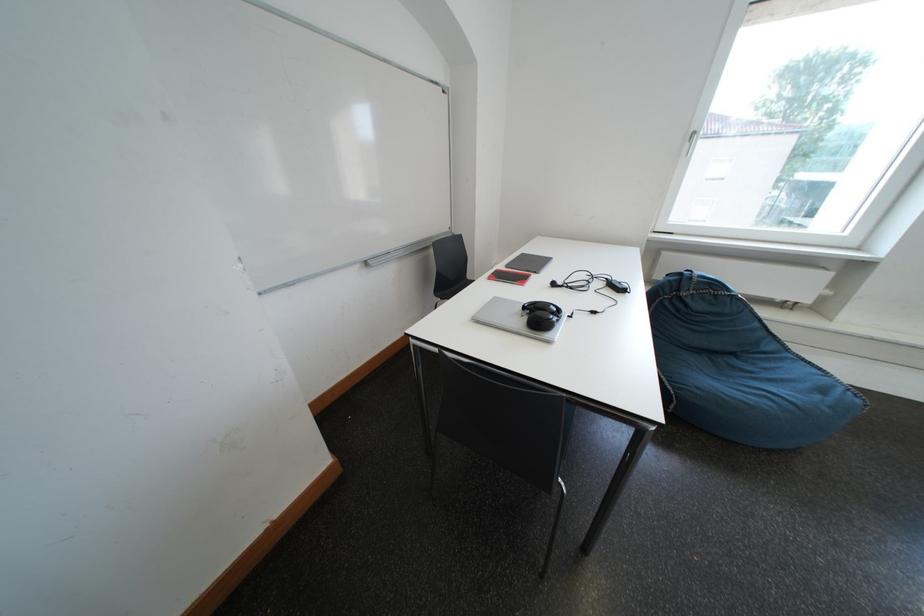
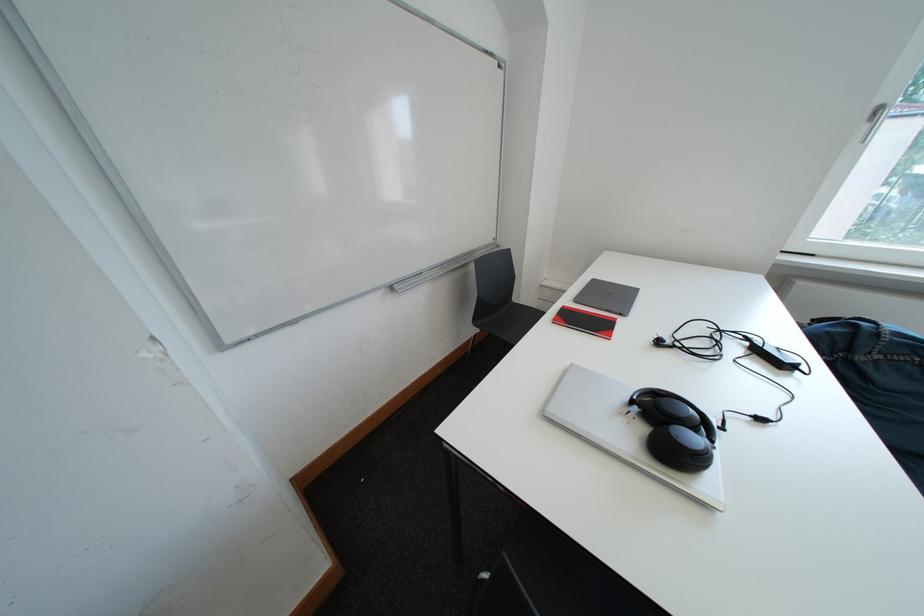
Question: Based on the continuous images, in which direction is the camera rotating? Reply with the corresponding letter.

Choices:
 (A) Left
 (B) Right
 (C) Up
 (D) Down

Answer: (A)